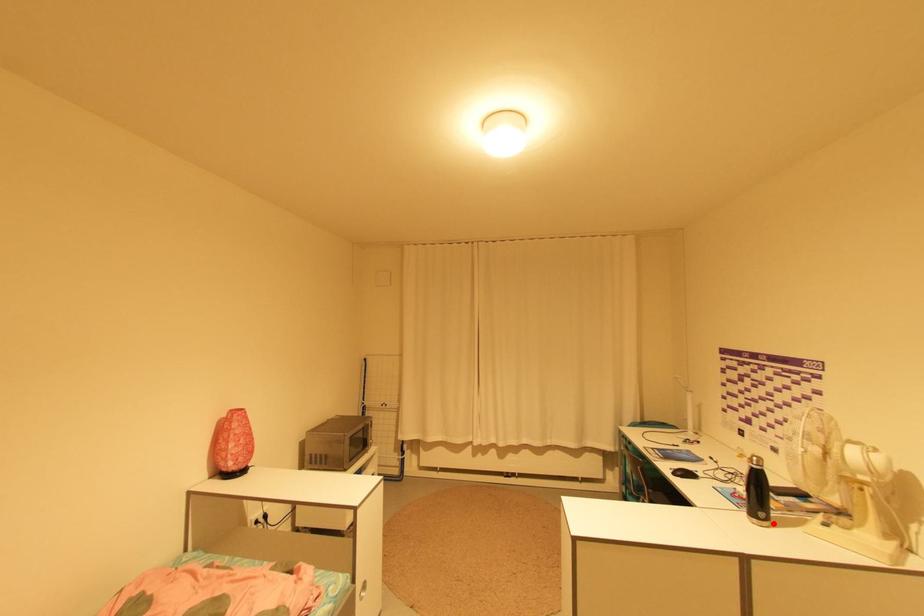
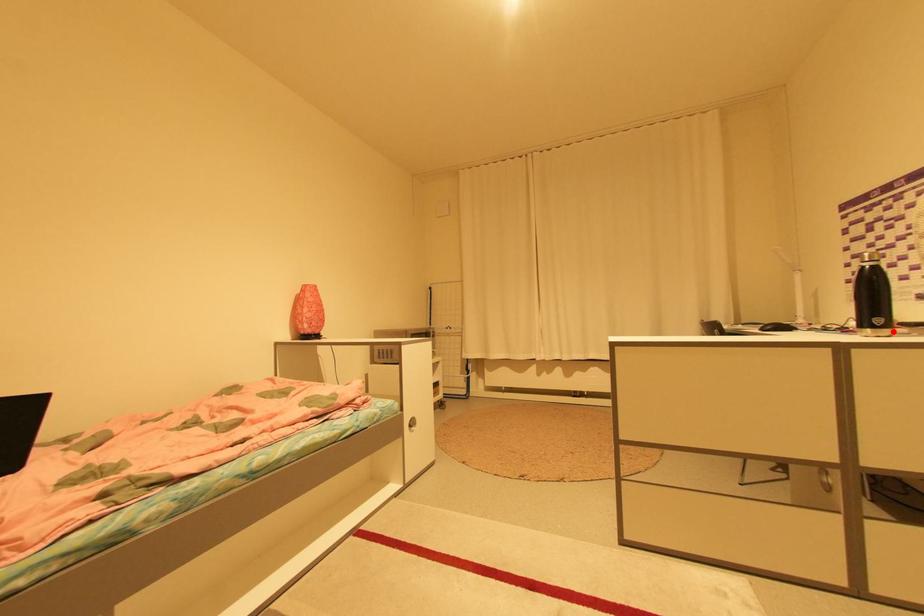
I am providing you with two images of the same scene from different viewpoints. A red point is marked on the first image and another point is marked on the second image. Does the point marked in image1 correspond to the same location as the one in image2?

Yes